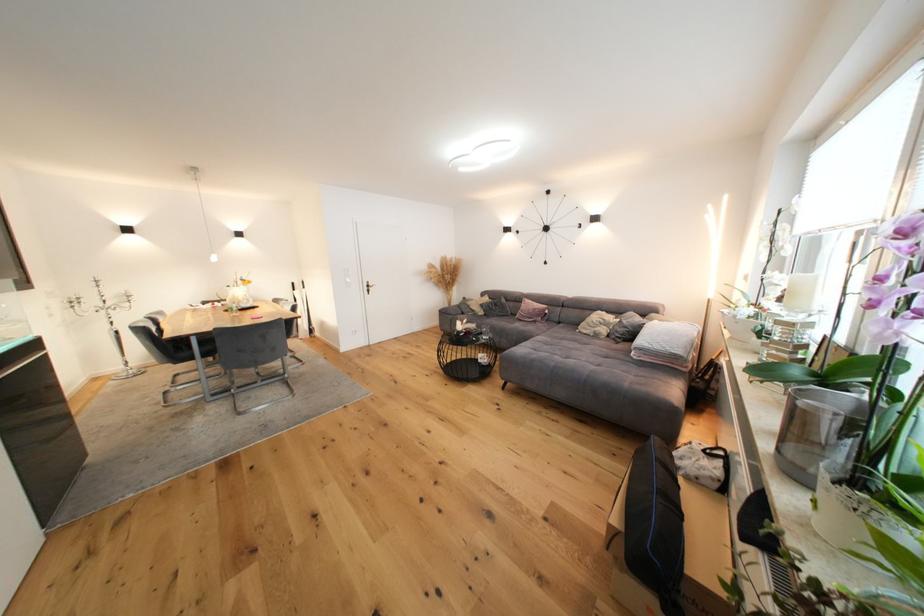
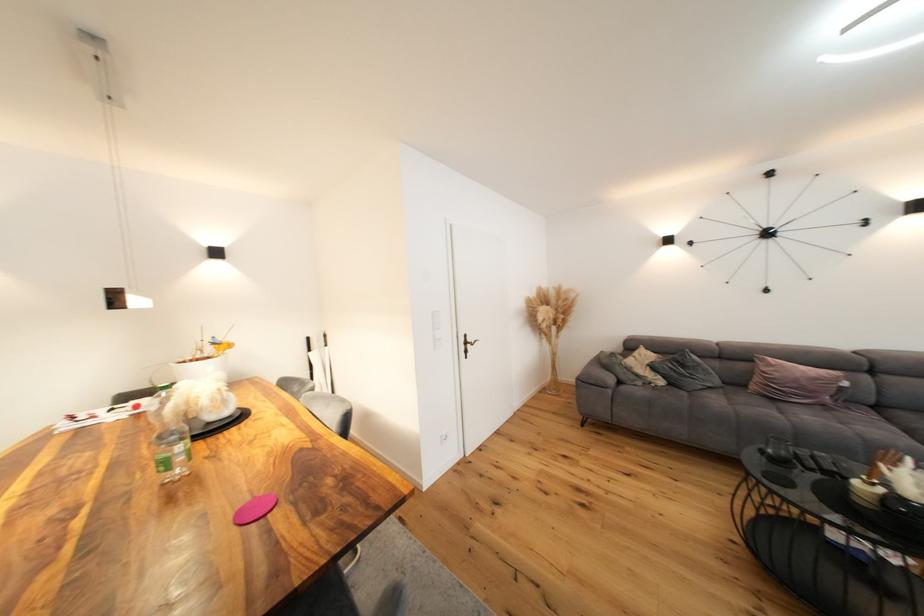
Find the pixel in the second image that matches the point at 513,320 in the first image.

(727, 392)